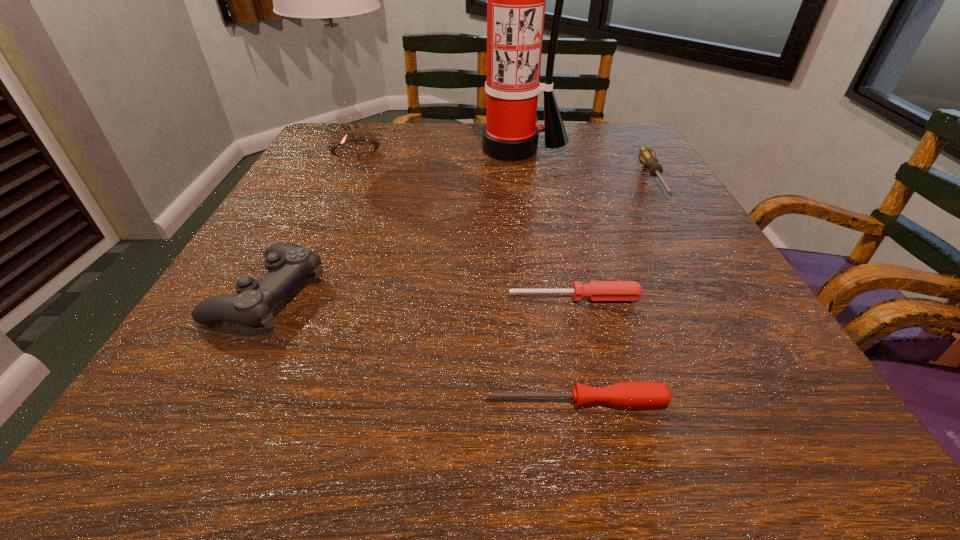
Where is `vacant space located at the tip of the tallest screwdriver`? This screenshot has width=960, height=540. vacant space located at the tip of the tallest screwdriver is located at coordinates (702, 256).

The height and width of the screenshot is (540, 960). I want to click on free point located 0.230m on the front of the second farthest screwdriver, so click(x=608, y=438).

Identify the location of free space located at the tip of the nearest screwdriver. The image size is (960, 540). (245, 402).

The height and width of the screenshot is (540, 960). Find the location of `free point located 0.240m at the tip of the nearest screwdriver`. free point located 0.240m at the tip of the nearest screwdriver is located at coordinates (300, 402).

I want to click on vacant space situated 0.380m at the tip of the nearest screwdriver, so click(191, 402).

Find the location of `fire extinguisher at the far edge`. fire extinguisher at the far edge is located at coordinates (516, 0).

This screenshot has height=540, width=960. Find the location of `table lamp at the far edge`. table lamp at the far edge is located at coordinates (328, 0).

The height and width of the screenshot is (540, 960). Identify the location of screwdriver positioned at the far edge. (647, 157).

The height and width of the screenshot is (540, 960). Find the location of `object situated at the near edge`. object situated at the near edge is located at coordinates (624, 395).

Locate an element on the screen. This screenshot has height=540, width=960. table lamp that is at the left edge is located at coordinates (328, 0).